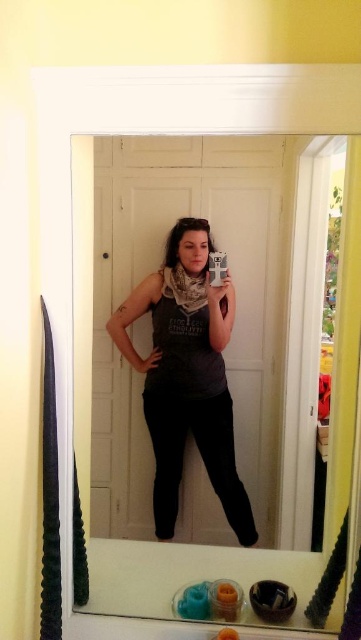
Question: Is clear glass mirror at center thinner than matte gray tank top at center?

Choices:
 (A) no
 (B) yes

Answer: (A)

Question: Is clear glass mirror at center bigger than matte gray tank top at center?

Choices:
 (A) yes
 (B) no

Answer: (A)

Question: Does clear glass mirror at center appear on the right side of matte gray tank top at center?

Choices:
 (A) yes
 (B) no

Answer: (A)

Question: Which of the following is the closest to the observer?

Choices:
 (A) (223, 330)
 (B) (132, 461)

Answer: (A)

Question: Which point appears closest to the camera in this image?

Choices:
 (A) (323, 241)
 (B) (166, 252)

Answer: (A)

Question: Which point appears farthest from the camera in this image?

Choices:
 (A) (167, 609)
 (B) (206, 250)

Answer: (B)